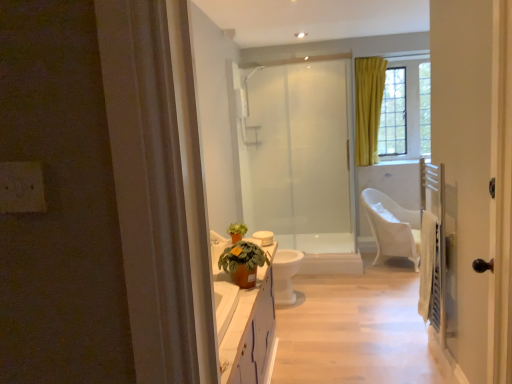
The width and height of the screenshot is (512, 384). Identify the location of free spot in front of white plastic chair at right. (391, 281).